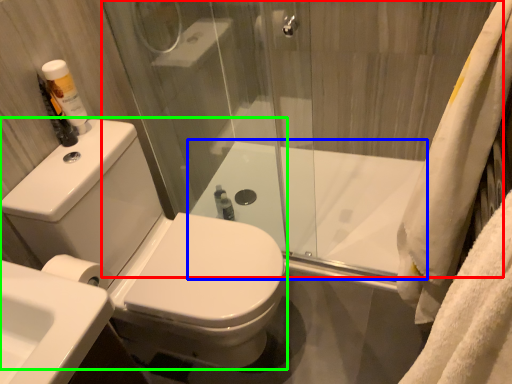
Question: Considering the real-world distances, which object is closest to shower door (highlighted by a red box)? bath (highlighted by a blue box) or porcelain (highlighted by a green box).

Choices:
 (A) bath
 (B) porcelain

Answer: (A)